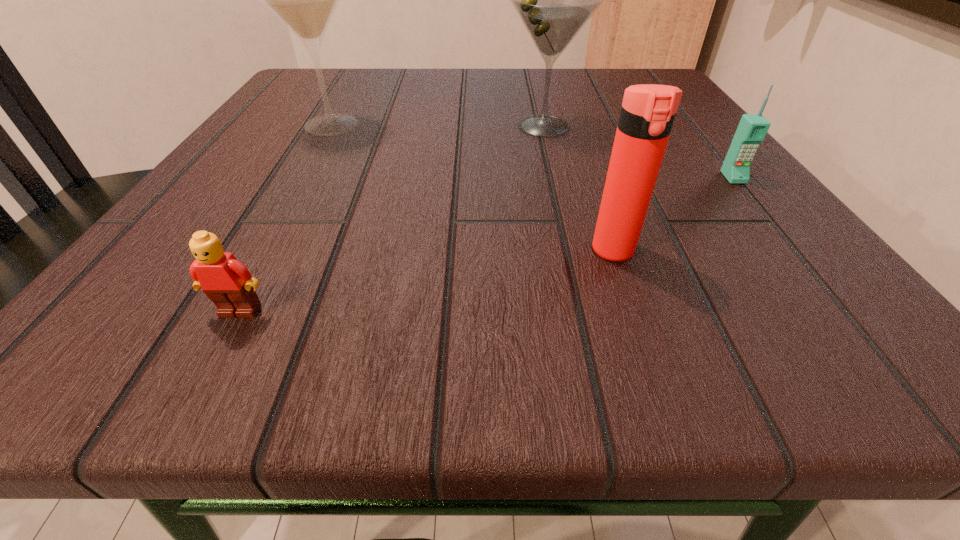
Locate an element on the screen. free spot at the right edge of the desktop is located at coordinates (711, 185).

I want to click on vacant area at the far left corner, so click(x=359, y=91).

Identify the location of vacant space at the far right corner of the desktop. Image resolution: width=960 pixels, height=540 pixels. (594, 71).

I want to click on empty location between the left martini and the thermos bottle, so click(472, 188).

At what (x,y) coordinates should I click in order to perform the action: click on vacant space that's between the thermos bottle and the left martini. Please return your answer as a coordinate pair (x, y). Image resolution: width=960 pixels, height=540 pixels. Looking at the image, I should click on (472, 188).

Where is `unoccupied area between the Lego and the fourth farthest object`? The height and width of the screenshot is (540, 960). unoccupied area between the Lego and the fourth farthest object is located at coordinates (427, 281).

Find the location of a particular element. The width and height of the screenshot is (960, 540). empty space between the cellular telephone and the left martini is located at coordinates (533, 151).

The height and width of the screenshot is (540, 960). Find the location of `free space between the second nearest object and the nearest object`. free space between the second nearest object and the nearest object is located at coordinates (427, 281).

Locate an element on the screen. This screenshot has width=960, height=540. free point between the second nearest object and the second shortest object is located at coordinates (674, 214).

Find the location of a particular element. Image resolution: width=960 pixels, height=540 pixels. vacant point located between the second nearest object and the left martini is located at coordinates pos(472,188).